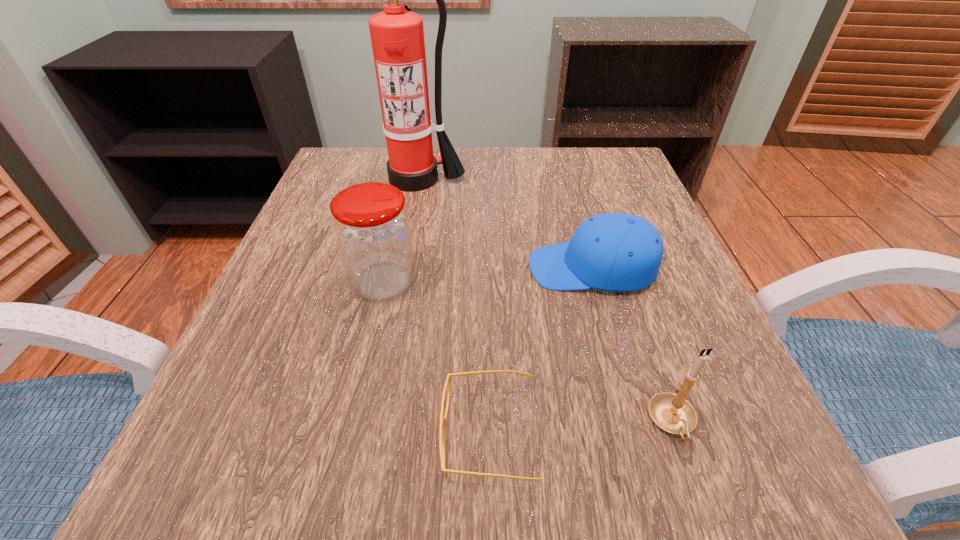
Identify the location of vacant space situated 0.330m on the front-facing side of the second shortest object. (349, 268).

This screenshot has width=960, height=540. Identify the location of vacant space located in front of the lenses of the shortest object. (257, 434).

I want to click on vacant space located 0.240m in front of the lenses of the shortest object, so click(x=257, y=434).

Identify the location of vacant space situated 0.140m in front of the lenses of the shortest object. (334, 434).

Find the location of a particular element. The image size is (960, 540). object that is at the far edge is located at coordinates (397, 36).

The image size is (960, 540). Identify the location of candle holder that is at the near edge. (671, 412).

Where is `spectacles positioned at the near edge`? spectacles positioned at the near edge is located at coordinates (442, 418).

I want to click on fire extinguisher located in the left edge section of the desktop, so click(x=397, y=36).

The image size is (960, 540). Find the location of `jar present at the left edge`. jar present at the left edge is located at coordinates (372, 228).

Locate an element on the screen. The image size is (960, 540). candle holder that is at the right edge is located at coordinates (671, 412).